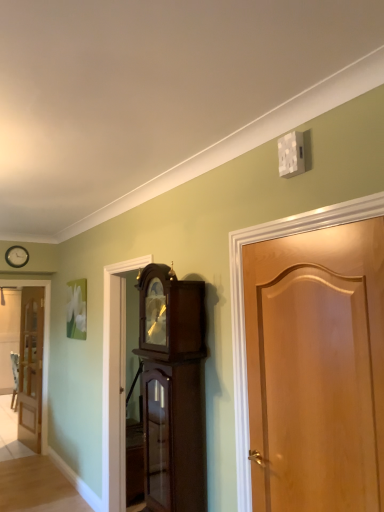
Question: Is matte black clock at upper left thinner than dark wood grandfather clock at center?

Choices:
 (A) no
 (B) yes

Answer: (B)

Question: From a real-world perspective, is matte black clock at upper left positioned over dark wood grandfather clock at center based on gravity?

Choices:
 (A) yes
 (B) no

Answer: (A)

Question: Can you confirm if matte black clock at upper left is positioned to the left of dark wood grandfather clock at center?

Choices:
 (A) yes
 (B) no

Answer: (A)

Question: Is matte black clock at upper left placed right next to dark wood grandfather clock at center?

Choices:
 (A) no
 (B) yes

Answer: (A)

Question: Considering the relative sizes of matte black clock at upper left and dark wood grandfather clock at center in the image provided, is matte black clock at upper left taller than dark wood grandfather clock at center?

Choices:
 (A) yes
 (B) no

Answer: (B)

Question: Is light brown wooden door at left, placed as the 1th door when sorted from back to front, wider or thinner than matte black clock at upper left?

Choices:
 (A) wide
 (B) thin

Answer: (A)

Question: From their relative heights in the image, would you say light brown wooden door at left, the second door in the front-to-back sequence, is taller or shorter than matte black clock at upper left?

Choices:
 (A) short
 (B) tall

Answer: (B)

Question: From a real-world perspective, is light brown wooden door at left, the second door in the front-to-back sequence, positioned above or below matte black clock at upper left?

Choices:
 (A) below
 (B) above

Answer: (A)

Question: In the image, is light brown wooden door at left, the first door positioned from the left, positioned in front of or behind matte black clock at upper left?

Choices:
 (A) behind
 (B) front

Answer: (A)

Question: Choose the correct answer: Is light brown wooden door at left, placed as the 1th door when sorted from back to front, inside dark wood grandfather clock at center or outside it?

Choices:
 (A) inside
 (B) outside

Answer: (B)

Question: Is light brown wooden door at left, the 2th door positioned from the right, taller or shorter than dark wood grandfather clock at center?

Choices:
 (A) tall
 (B) short

Answer: (A)

Question: Is light brown wooden door at left, the second door in the front-to-back sequence, wider or thinner than dark wood grandfather clock at center?

Choices:
 (A) wide
 (B) thin

Answer: (B)

Question: Is light brown wooden door at left, the 2th door positioned from the right, to the left or to the right of dark wood grandfather clock at center in the image?

Choices:
 (A) left
 (B) right

Answer: (A)

Question: Looking at their shapes, would you say light brown wooden door at left, the 2th door positioned from the right, is wider or thinner than light brown wood door at right, the second door viewed from the left?

Choices:
 (A) wide
 (B) thin

Answer: (B)

Question: Is light brown wooden door at left, the 2th door positioned from the right, taller or shorter than light brown wood door at right, arranged as the second door when viewed from the back?

Choices:
 (A) tall
 (B) short

Answer: (A)